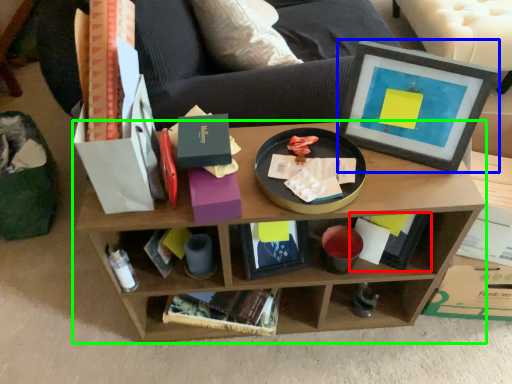
Question: Considering the real-world distances, which object is farthest from book (highlighted by a red box)? picture frame (highlighted by a blue box) or shelf (highlighted by a green box)?

Choices:
 (A) picture frame
 (B) shelf

Answer: (A)